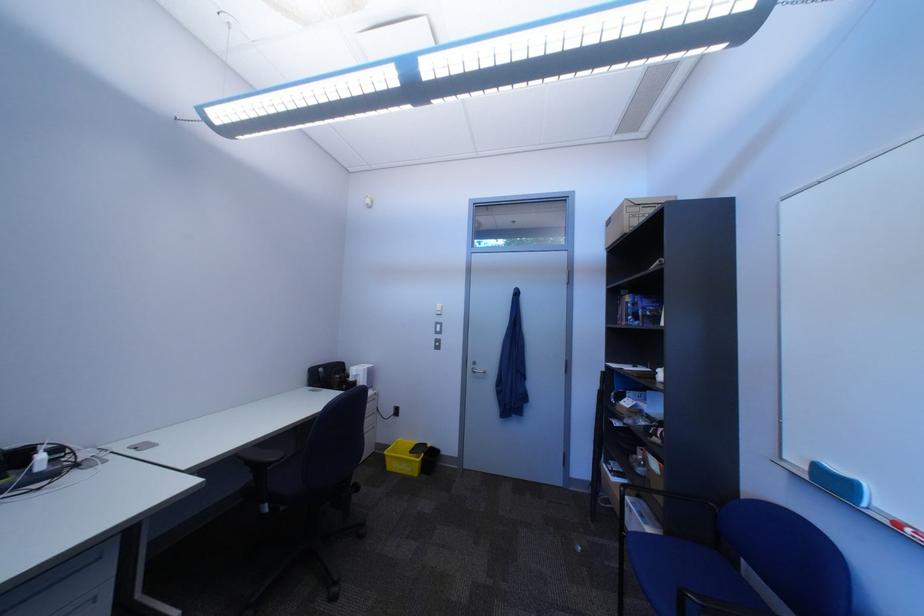
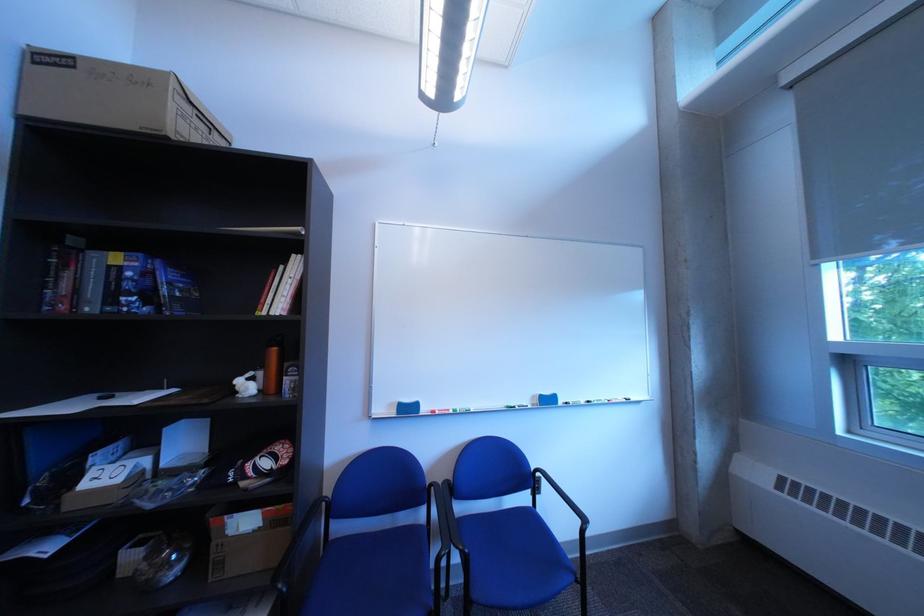
Where in the second image is the point corresponding to [664,484] from the first image?

(237, 565)